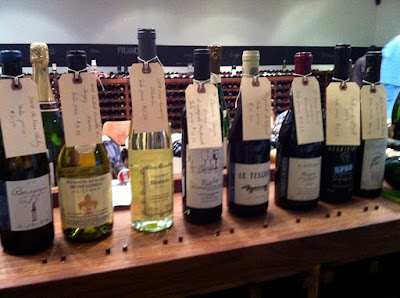
Where is `green bottle`? green bottle is located at coordinates (221, 99), (226, 115), (45, 124).